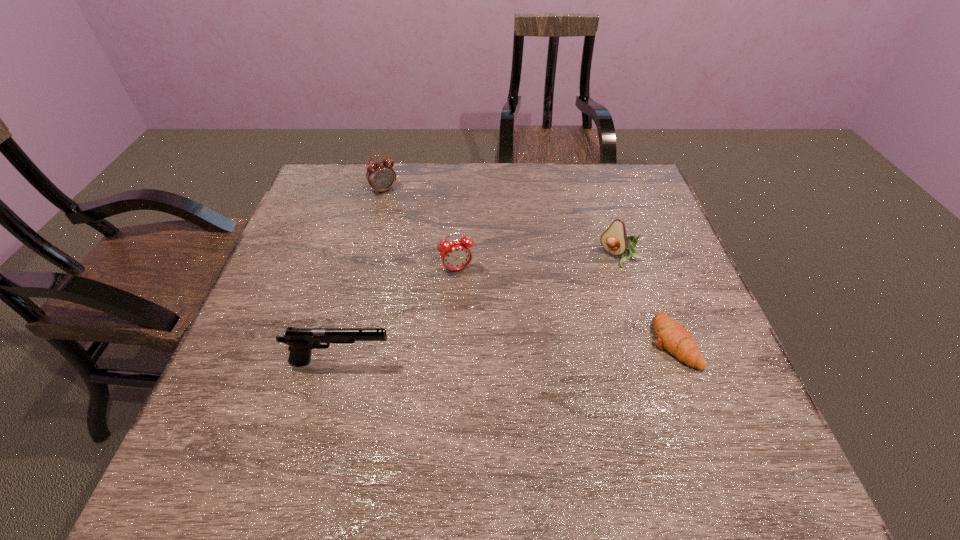
In order to click on gun in this screenshot , I will do `click(301, 341)`.

You are a GUI agent. You are given a task and a screenshot of the screen. Output one action in this format:
    pyautogui.click(x=<x>, y=<y>)
    Task: Click on the crescent roll
    This screenshot has height=540, width=960.
    Given the screenshot: What is the action you would take?
    pyautogui.click(x=673, y=337)

Locate an element on the screen. the left alarm clock is located at coordinates (381, 176).

Locate an element on the screen. the farther alarm clock is located at coordinates (381, 176).

Identify the location of avocado. The height and width of the screenshot is (540, 960). (614, 240).

In order to click on the third object from right to left in this screenshot , I will do `click(455, 255)`.

Identify the location of the nearer alarm clock. The image size is (960, 540). (455, 255).

You are a GUI agent. You are given a task and a screenshot of the screen. Output one action in this format:
    pyautogui.click(x=<x>, y=<y>)
    Task: Click on the vacant space located at the aiming end of the gun
    This screenshot has height=540, width=960.
    Given the screenshot: What is the action you would take?
    click(483, 362)

Locate an element on the screen. The width and height of the screenshot is (960, 540). vacant position located 0.190m on the left of the shortest object is located at coordinates (564, 342).

Locate an element on the screen. The image size is (960, 540). free location located 0.230m on the face of the farthest object is located at coordinates (420, 240).